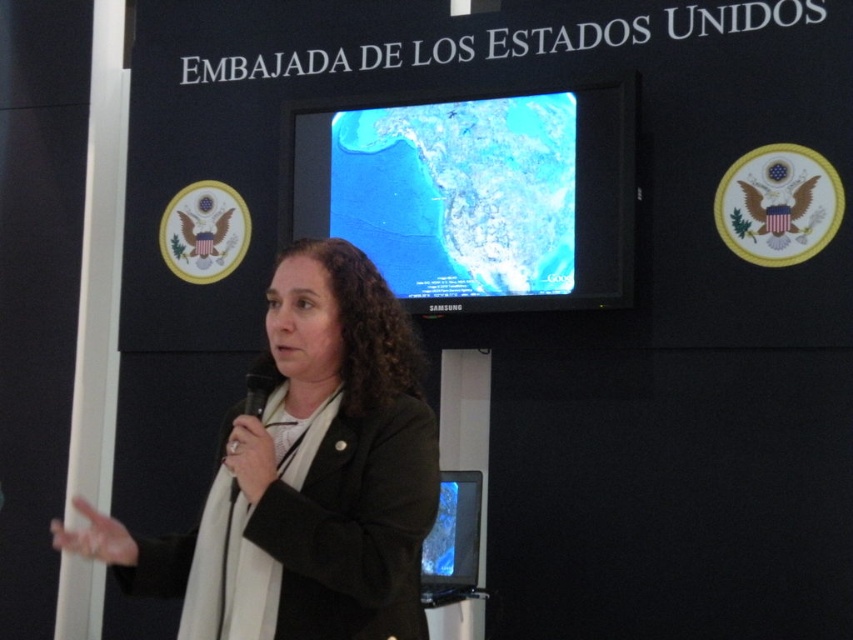
Which is more to the right, matte black screen at center or matte blue screen at center?

matte blue screen at center is more to the right.

Does point (396, 106) come closer to viewer compared to point (473, 545)?

No, (396, 106) is further to viewer.

This screenshot has width=853, height=640. I want to click on matte black screen at center, so click(x=474, y=193).

Measure the distance between point (384, 618) and camera.

The distance of point (384, 618) from camera is 1.71 meters.

Which is more to the left, black matte blazer at center or matte blue screen at center?

black matte blazer at center is more to the left.

Is point (399, 364) farther from viewer compared to point (444, 499)?

No, (399, 364) is closer to viewer.

You are a GUI agent. You are given a task and a screenshot of the screen. Output one action in this format:
    pyautogui.click(x=<x>, y=<y>)
    Task: Click on the black matte blazer at center
    The image size is (853, 640).
    Given the screenshot: What is the action you would take?
    pyautogui.click(x=340, y=452)

Which is more to the left, matte black screen at center or black matte blazer at center?

black matte blazer at center

Is matte black screen at center thinner than black matte blazer at center?

In fact, matte black screen at center might be wider than black matte blazer at center.

Find the location of a particular element. The image size is (853, 640). matte black screen at center is located at coordinates (474, 193).

Identify the location of matte black screen at center. (474, 193).